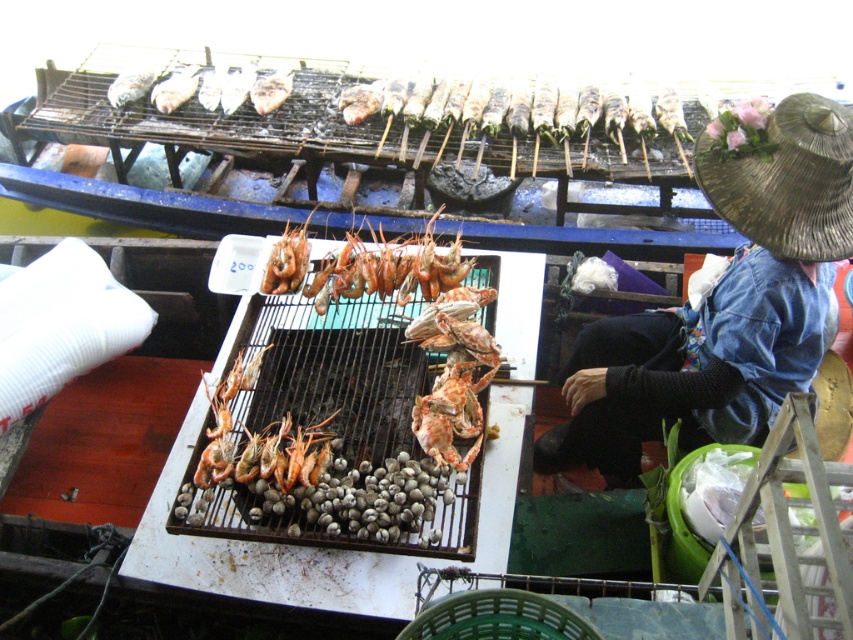
This screenshot has width=853, height=640. Describe the element at coordinates (782, 173) in the screenshot. I see `brown woven straw hat at upper right` at that location.

Can you confirm if brown woven straw hat at upper right is shorter than shiny orange shrimp at center?

No, brown woven straw hat at upper right is not shorter than shiny orange shrimp at center.

You are a GUI agent. You are given a task and a screenshot of the screen. Output one action in this format:
    pyautogui.click(x=<x>, y=<y>)
    Task: Click on the brown woven straw hat at upper right
    
    Given the screenshot: What is the action you would take?
    (x=782, y=173)